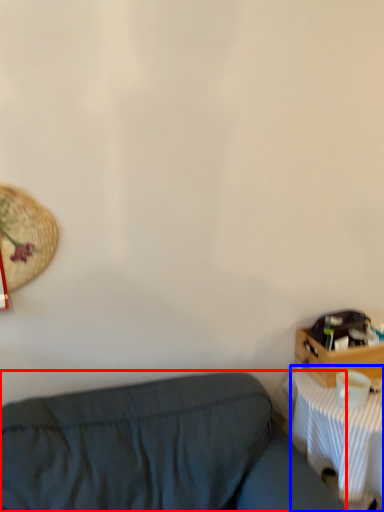
Question: Which point is further to the camera, studio couch (highlighted by a red box) or desk (highlighted by a blue box)?

Choices:
 (A) studio couch
 (B) desk

Answer: (B)